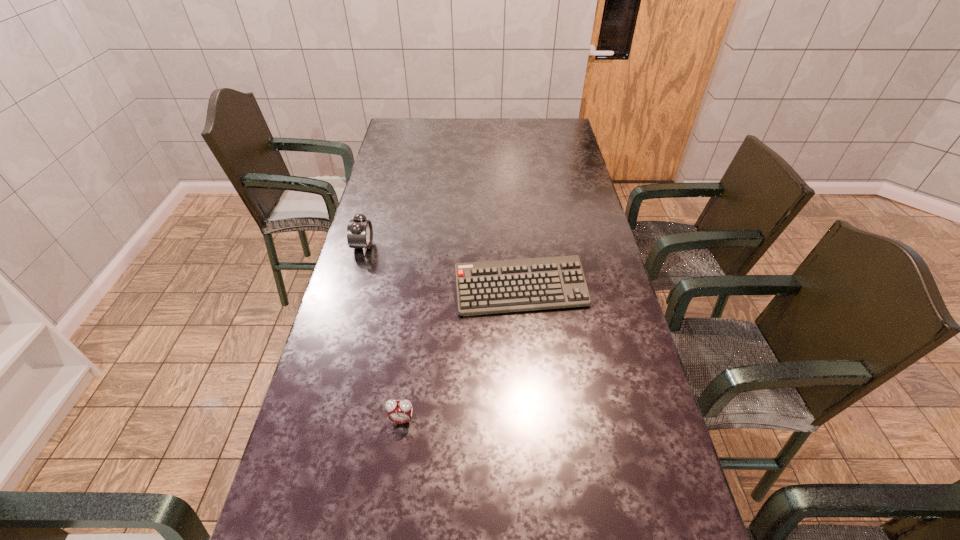
Identify the location of the leftmost object. The height and width of the screenshot is (540, 960). (359, 231).

This screenshot has height=540, width=960. I want to click on the left alarm clock, so point(359,231).

Where is `the second shortest object`? Image resolution: width=960 pixels, height=540 pixels. the second shortest object is located at coordinates (399, 411).

Locate an element on the screen. the nearer alarm clock is located at coordinates (399, 411).

Find the location of a particular element. The height and width of the screenshot is (540, 960). the shortest object is located at coordinates coord(490,287).

At what (x,y) coordinates should I click in order to perform the action: click on the rightmost object. Please return your answer as a coordinate pair (x, y). Looking at the image, I should click on (490, 287).

You are a GUI agent. You are given a task and a screenshot of the screen. Output one action in this format:
    pyautogui.click(x=<x>, y=<y>)
    Task: Click on the free space located 0.240m on the front side of the left alarm clock
    
    Given the screenshot: What is the action you would take?
    pyautogui.click(x=444, y=246)

This screenshot has height=540, width=960. Identify the location of free space located on the clock face of the nearest object. (396, 464).

Image resolution: width=960 pixels, height=540 pixels. I want to click on vacant space located 0.050m on the right of the computer keyboard, so click(603, 291).

This screenshot has width=960, height=540. Find the location of `object that is at the left edge`. object that is at the left edge is located at coordinates [359, 231].